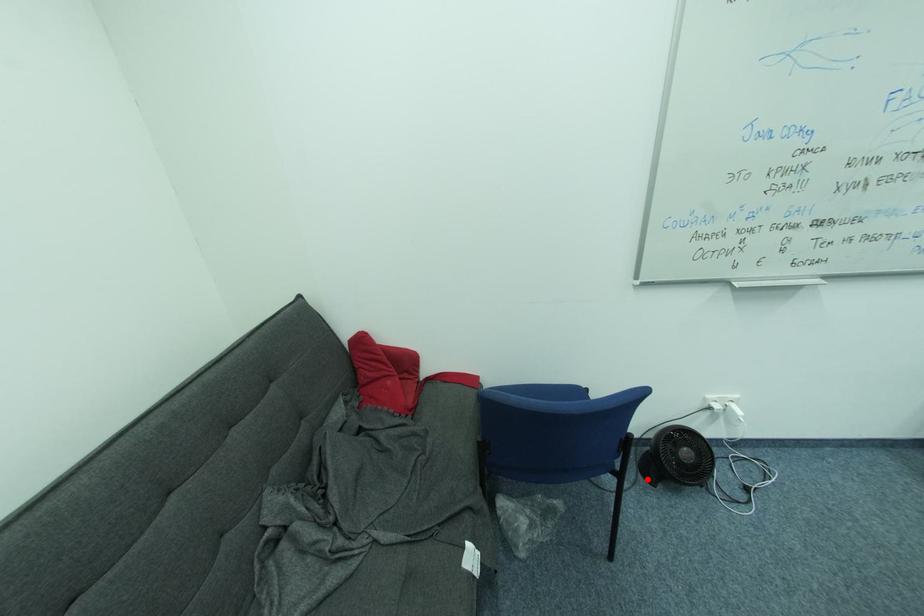
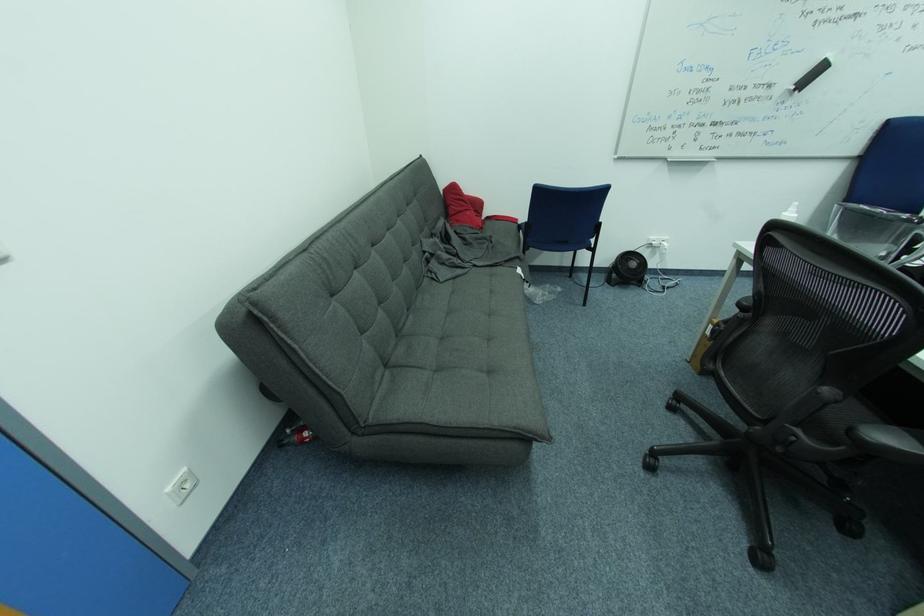
Question: I am providing you with two images of the same scene from different viewpoints. A red point is shown in image1. For the corresponding object point in image2, is it positioned nearer or farther from the camera?

Choices:
 (A) Nearer
 (B) Farther

Answer: (B)